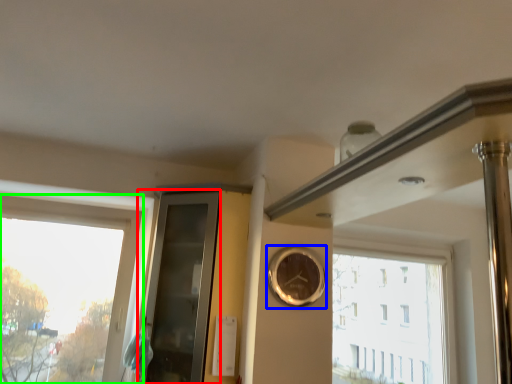
Question: Estimate the real-world distances between objects in this image. Which object is closer to glass door (highlighted by a red box), clock (highlighted by a blue box) or window (highlighted by a green box)?

Choices:
 (A) clock
 (B) window

Answer: (B)